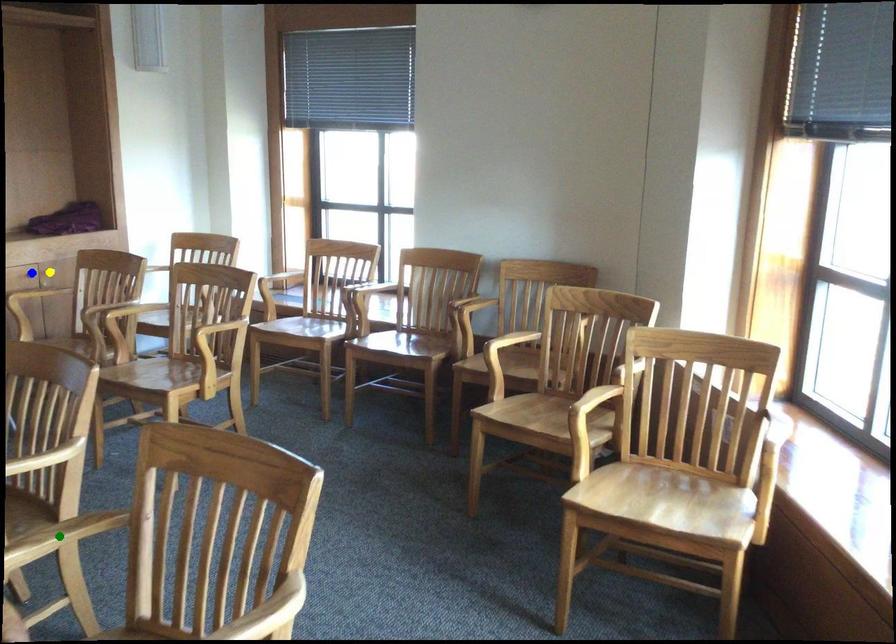
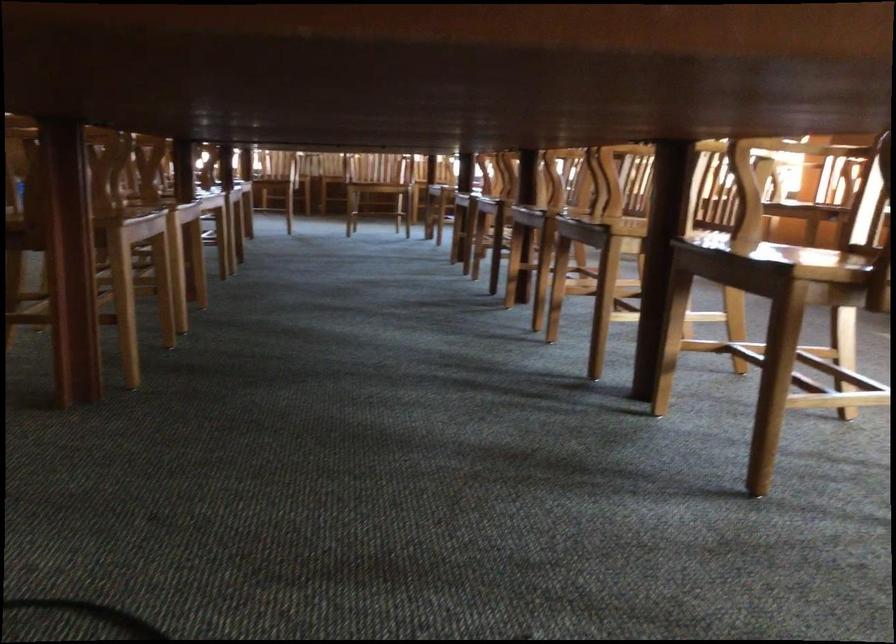
I am providing you with two images of the same scene from different viewpoints. Three points are marked in image1. Which point corresponds to a part or object that is occluded in image2?In image1, three points are marked. Which of them correspond to a part or object that is occluded in image2?Among the three points shown in image1, which one corresponds to a part or object that is no longer visible due to occlusion in image2?

green point, yellow point, blue point cannot be seen in image2.